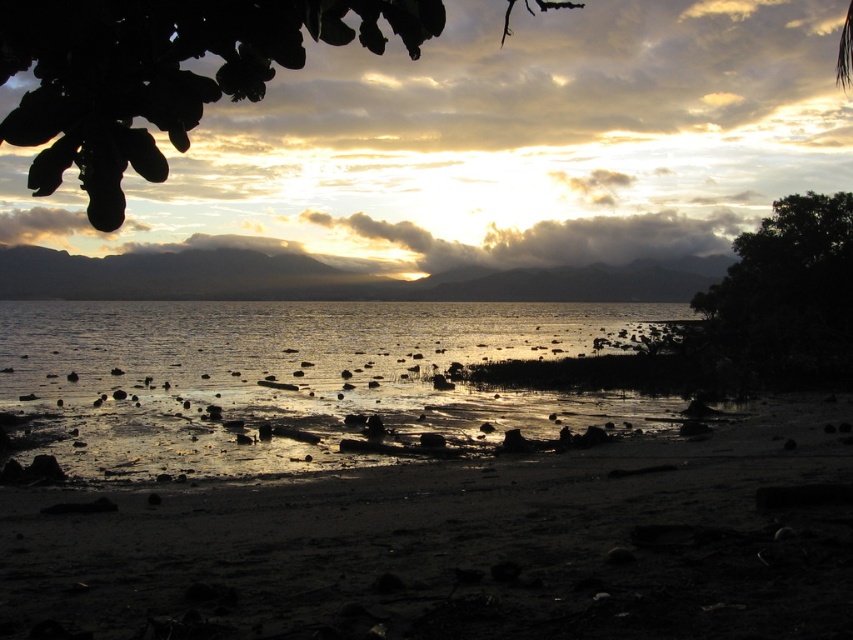
Question: Can you confirm if glistening water at center is bigger than dark green leafy tree at right?

Choices:
 (A) yes
 (B) no

Answer: (A)

Question: Does dull sand at lower center have a greater width compared to cloudy sky at upper center?

Choices:
 (A) no
 (B) yes

Answer: (A)

Question: Is dark green leafy tree at right to the left of cloudy sky at upper center from the viewer's perspective?

Choices:
 (A) yes
 (B) no

Answer: (A)

Question: Which of the following is the farthest from the observer?

Choices:
 (A) (788, 218)
 (B) (177, 371)
 (C) (401, 227)

Answer: (C)

Question: Estimate the real-world distances between objects in this image. Which object is farther from the dark green leafy tree at right?

Choices:
 (A) green leafy tree at upper center
 (B) dull sand at lower center
 (C) glistening water at center

Answer: (A)

Question: Which point appears closest to the camera in this image?

Choices:
 (A) (834, 310)
 (B) (216, 328)
 (C) (341, 17)

Answer: (C)